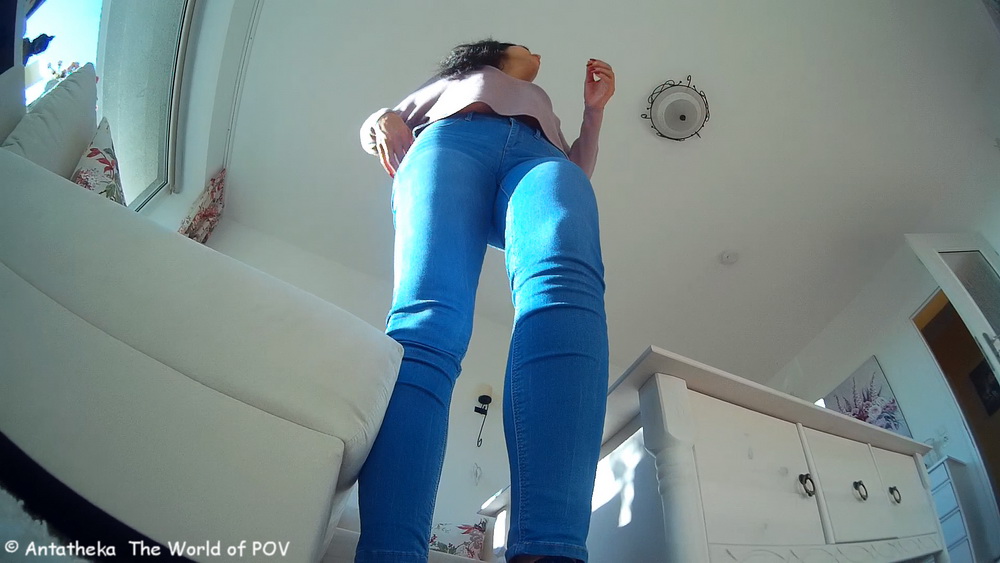
Locate an element on the screen. throw pillow is located at coordinates (101, 168).